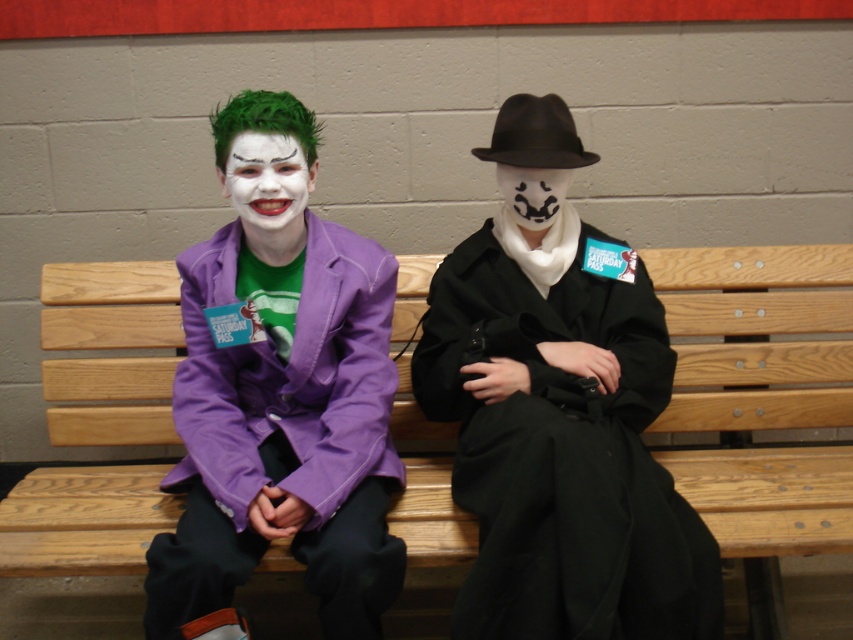
You are standing in front of the two people sitting on the wooden bench. You want to take a photo of them without getting too close. If the minimum focus distance of your camera is 1.5 meters, will you be able to take a clear photo of the point at (248, 156)?

The point at (248, 156) is 1.65 meters away from the viewer. Since the minimum focus distance of your camera is 1.5 meters, you can take a clear photo of the point at (248, 156) because it is within the camera range.

In the scene shown: You are standing at the point with coordinates point (x=251, y=150) and want to walk to the point with coordinates point (x=560, y=202). Which direction should you face to walk towards your destination?

You should face backward because point (x=251, y=150) is in front of point (x=560, y=202), so to reach point (x=560, y=202) you need to move backward from your current position.